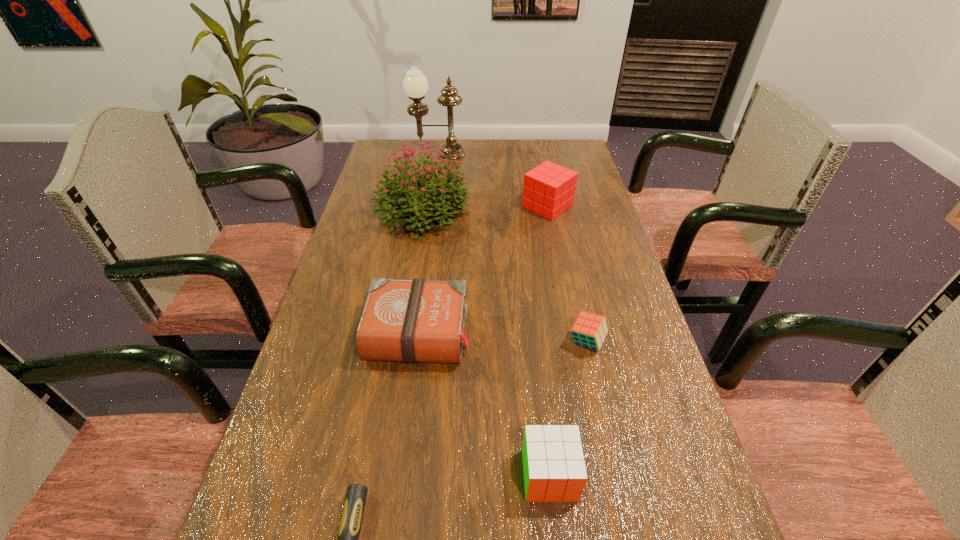
Select which object is the third closest to the shortest object. Please provide its 2D coordinates. Your answer should be formatted as a tuple, i.e. [(x, y)], where the tuple contains the x and y coordinates of a point satisfying the conditions above.

[(589, 330)]

Where is `cube that is the third closest to the farthest object`? cube that is the third closest to the farthest object is located at coordinates (554, 469).

Image resolution: width=960 pixels, height=540 pixels. Find the location of `the second closest cube to the Bible`. the second closest cube to the Bible is located at coordinates (589, 330).

Locate an element on the screen. The height and width of the screenshot is (540, 960). vacant position in the image that satisfies the following two spatial constraints: 1. on the front side of the nearest cube; 2. on the left side of the farthest object is located at coordinates (391, 475).

Locate an element on the screen. The width and height of the screenshot is (960, 540). vacant point that satisfies the following two spatial constraints: 1. on the front side of the second nearest cube; 2. on the left side of the second tallest object is located at coordinates (402, 342).

The image size is (960, 540). Identify the location of free location that satisfies the following two spatial constraints: 1. on the back side of the Bible; 2. on the left side of the farthest cube. click(x=436, y=206).

Locate an element on the screen. vacant space that satisfies the following two spatial constraints: 1. on the front side of the shortest cube; 2. on the right side of the tallest object is located at coordinates (411, 342).